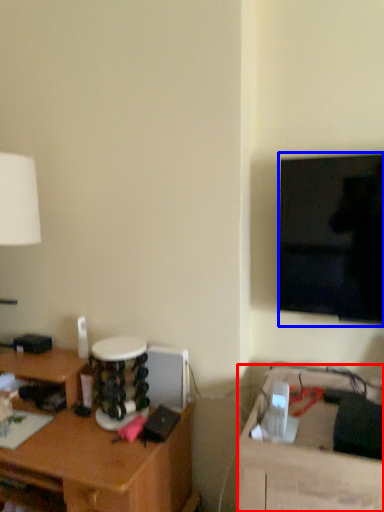
Question: Which object appears farthest to the camera in this image, table (highlighted by a red box) or television (highlighted by a blue box)?

Choices:
 (A) table
 (B) television

Answer: (B)